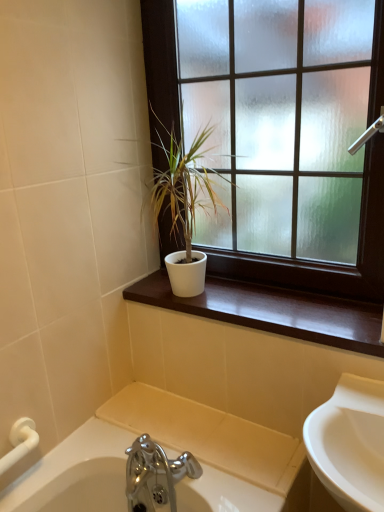
Describe the element at coordinates (332, 265) in the screenshot. I see `white matte window at upper center` at that location.

This screenshot has height=512, width=384. I want to click on white matte window at upper center, so click(332, 265).

Where is `white matte pot at center`? Image resolution: width=384 pixels, height=512 pixels. white matte pot at center is located at coordinates (184, 202).

Image resolution: width=384 pixels, height=512 pixels. What are the coordinates of `white matte window at upper center` in the screenshot? It's located at (332, 265).

From a real-world perspective, which object stands above the other?

white matte window at upper center.

From the image's perspective, is white matte window at upper center positioned above or below white matte pot at center?

Based on their image positions, white matte window at upper center is located above white matte pot at center.

Consider the image. How many degrees apart are the facing directions of white matte window at upper center and white matte pot at center?

There is a 0.533-degree angle between the facing directions of white matte window at upper center and white matte pot at center.

This screenshot has width=384, height=512. Find the location of `houseplant located underneath the white matte window at upper center (from a real-world perspective)`. houseplant located underneath the white matte window at upper center (from a real-world perspective) is located at coordinates (184, 202).

Which is more to the left, white matte pot at center or white matte window at upper center?

white matte pot at center.

From a real-world perspective, is white matte pot at center above or below white matte window at upper center?

white matte pot at center is below white matte window at upper center.

Considering the sizes of white matte pot at center and white matte window at upper center in the image, is white matte pot at center bigger or smaller than white matte window at upper center?

white matte pot at center is smaller than white matte window at upper center.

Does point (176, 231) appear closer or farther from the camera than point (217, 272)?

Point (176, 231) appears to be closer to the viewer than point (217, 272).

Looking at their sizes, would you say white glossy window sill at center is wider or thinner than white matte pot at center?

white glossy window sill at center is thinner than white matte pot at center.

Which is in front, white glossy window sill at center or white matte pot at center?

Positioned in front is white glossy window sill at center.

What are the coordinates of `houseplant that appears above the white glossy window sill at center (from a real-world perspective)` in the screenshot? It's located at (184, 202).

Who is shorter, white matte pot at center or white glossy window sill at center?

white glossy window sill at center is shorter.

Can you confirm if white matte pot at center is wider than white glossy window sill at center?

Indeed, white matte pot at center has a greater width compared to white glossy window sill at center.

Does white matte pot at center contain white glossy window sill at center?

That's incorrect, white glossy window sill at center is not inside white matte pot at center.

Is white glossy window sill at center beside white matte window at upper center?

No, white glossy window sill at center is not beside white matte window at upper center.

The image size is (384, 512). Identify the location of window above the white glossy window sill at center (from the image's perspective). (332, 265).

In the scene shown: Does white glossy window sill at center come behind white matte window at upper center?

Yes, it is.

Based on the photo, is white matte window at upper center inside or outside of white glossy window sill at center?

white matte window at upper center lies outside white glossy window sill at center.

Considering the positions of point (163, 216) and point (319, 314), is point (163, 216) closer or farther from the camera than point (319, 314)?

Point (163, 216) is positioned farther from the camera compared to point (319, 314).

Considering the relative sizes of white matte window at upper center and white glossy window sill at center in the image provided, is white matte window at upper center bigger than white glossy window sill at center?

Indeed, white matte window at upper center has a larger size compared to white glossy window sill at center.

This screenshot has height=512, width=384. I want to click on houseplant on the left of white matte window at upper center, so click(x=184, y=202).

Where is `window that appears on the right of white matte pot at center`? The height and width of the screenshot is (512, 384). window that appears on the right of white matte pot at center is located at coordinates (332, 265).

Based on their spatial positions, is white glossy window sill at center or white matte window at upper center closer to white matte pot at center?

white matte window at upper center is positioned closer to the anchor white matte pot at center.

Based on their spatial positions, is white matte window at upper center or white glossy window sill at center further from white matte pot at center?

white glossy window sill at center is further to white matte pot at center.

Looking at the image, which one is located closer to white matte window at upper center, white glossy window sill at center or white matte pot at center?

white glossy window sill at center lies closer to white matte window at upper center than the other object.

Estimate the real-world distances between objects in this image. Which object is closer to white matte window at upper center, white matte pot at center or white glossy window sill at center?

The object closer to white matte window at upper center is white glossy window sill at center.

When comparing their distances from white glossy window sill at center, does white matte window at upper center or white matte pot at center seem further?

The object further to white glossy window sill at center is white matte pot at center.

Which object lies further to the anchor point white glossy window sill at center, white matte pot at center or white matte window at upper center?

white matte pot at center.

Image resolution: width=384 pixels, height=512 pixels. What are the coordinates of `houseplant that lies between white matte window at upper center and white glossy window sill at center from top to bottom` in the screenshot? It's located at (184, 202).